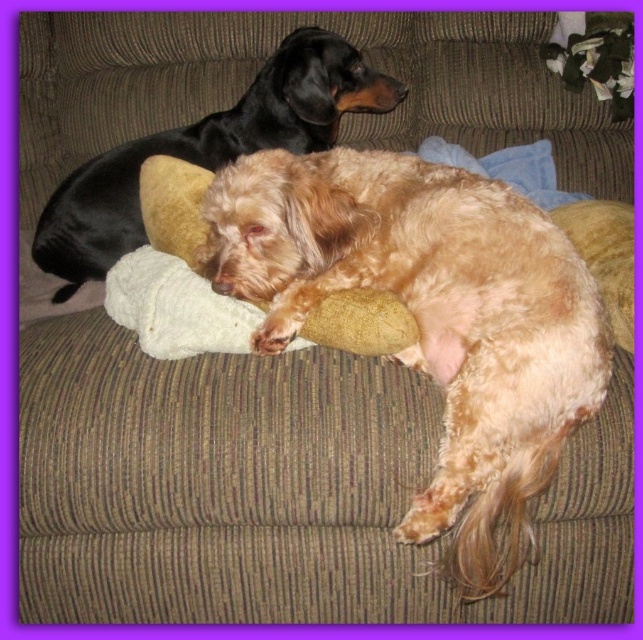
Question: Can you confirm if fuzzy golden dog at center is positioned to the left of shiny black dog at upper left?

Choices:
 (A) yes
 (B) no

Answer: (B)

Question: Which of the following is the closest to the observer?

Choices:
 (A) shiny black dog at upper left
 (B) fuzzy golden dog at center

Answer: (B)

Question: Which point is farther to the camera?

Choices:
 (A) fuzzy golden dog at center
 (B) shiny black dog at upper left

Answer: (B)

Question: Which point is farther to the camera?

Choices:
 (A) (212, 241)
 (B) (282, 52)

Answer: (B)

Question: Can you confirm if fuzzy golden dog at center is wider than shiny black dog at upper left?

Choices:
 (A) no
 (B) yes

Answer: (A)

Question: Can you confirm if fuzzy golden dog at center is thinner than shiny black dog at upper left?

Choices:
 (A) no
 (B) yes

Answer: (B)